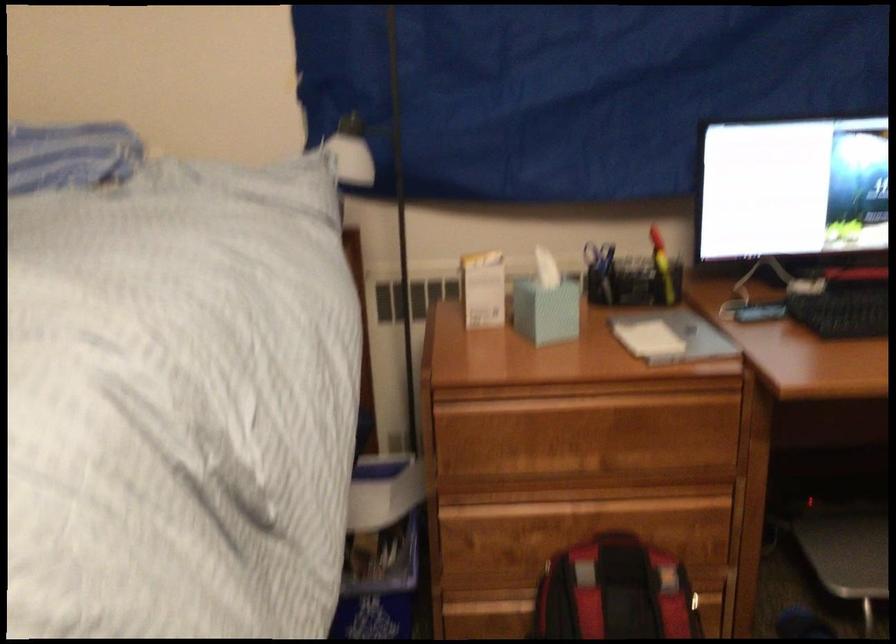
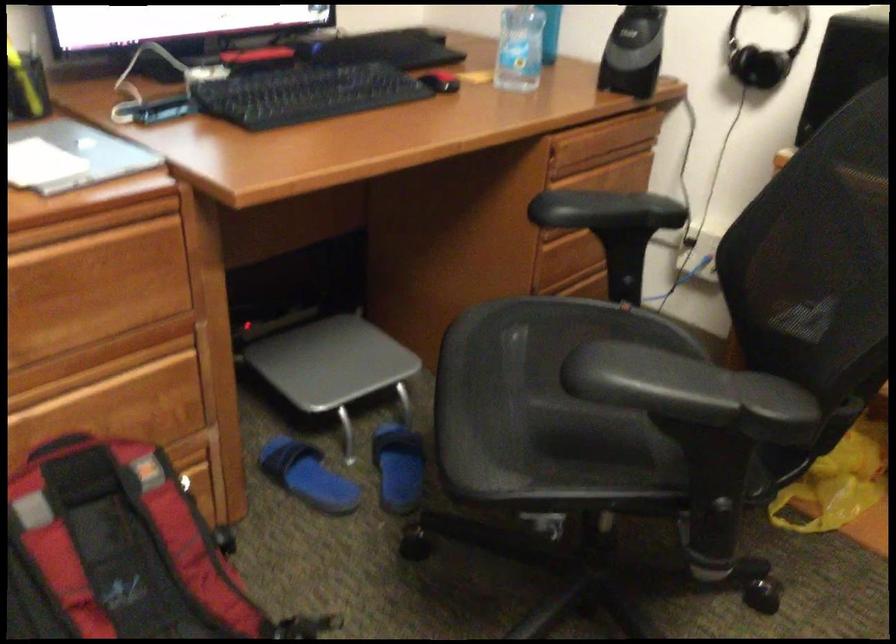
The images are taken continuously from a first-person perspective. In which direction is your viewpoint rotating?

The camera rotated toward right-down.